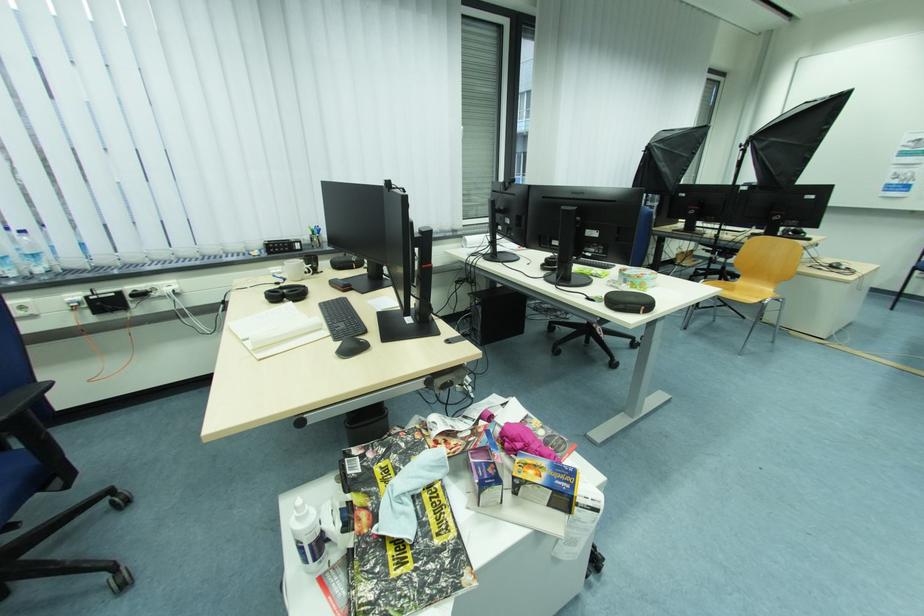
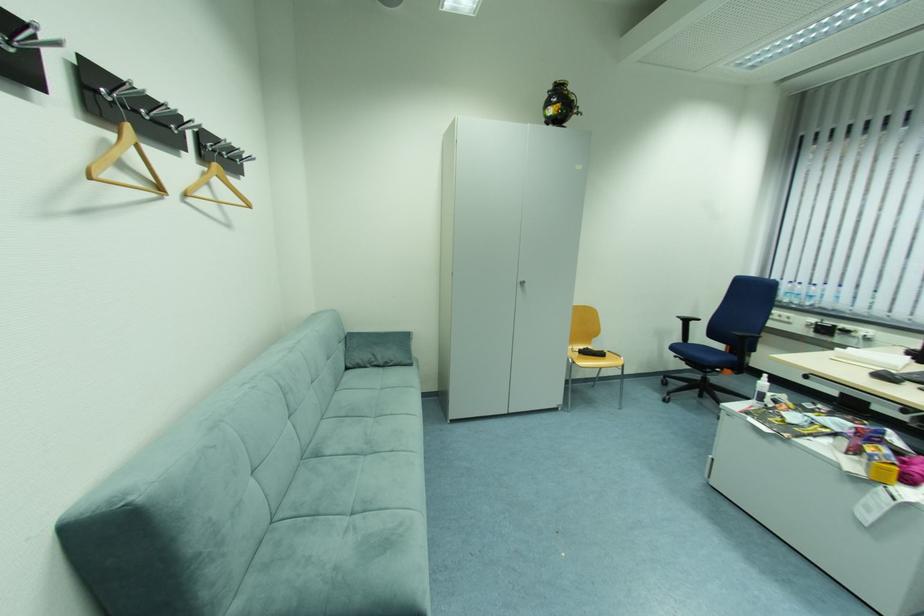
In the second image, find the point that corresponds to pixel 27 273 in the first image.

(807, 302)